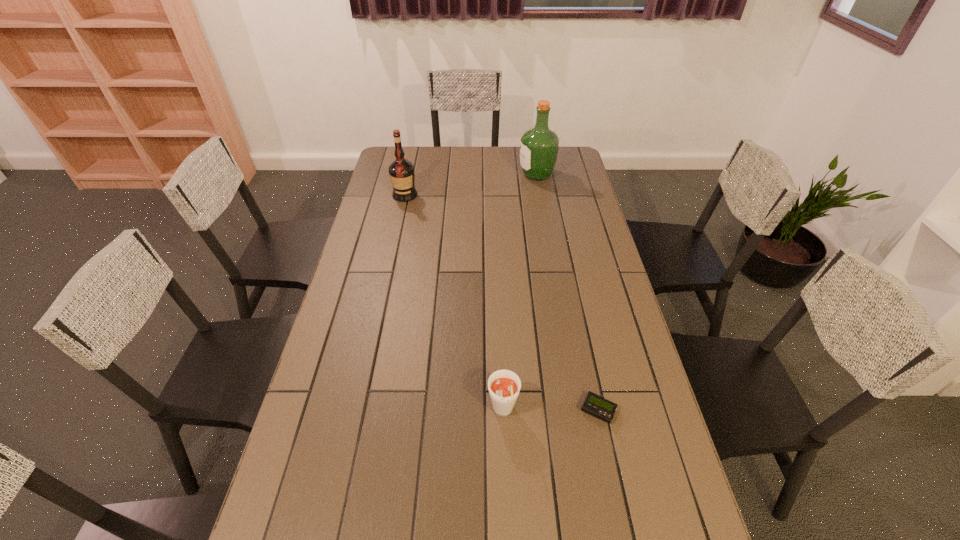
This screenshot has width=960, height=540. I want to click on empty space that is in between the shortest object and the third object from right to left, so click(x=550, y=411).

Image resolution: width=960 pixels, height=540 pixels. I want to click on vacant region between the right liquor and the root beer, so click(x=519, y=294).

Image resolution: width=960 pixels, height=540 pixels. Find the location of `object that stands as the closest to the root beer`. object that stands as the closest to the root beer is located at coordinates click(595, 405).

Identify the location of the second closest object to the third tallest object. The height and width of the screenshot is (540, 960). (401, 171).

The height and width of the screenshot is (540, 960). Find the location of `vacant space that satisfies the following two spatial constraints: 1. on the front-facing side of the farther liquor; 2. on the right side of the shortest object`. vacant space that satisfies the following two spatial constraints: 1. on the front-facing side of the farther liquor; 2. on the right side of the shortest object is located at coordinates (578, 410).

You are a GUI agent. You are given a task and a screenshot of the screen. Output one action in this format:
    pyautogui.click(x=<x>, y=<y>)
    Task: Click on the free space in the image that satisfies the following two spatial constraints: 1. on the front-facing side of the right liquor; 2. on the right side of the beeper
    The width and height of the screenshot is (960, 540).
    Given the screenshot: What is the action you would take?
    pyautogui.click(x=578, y=410)

This screenshot has height=540, width=960. Identify the location of free region that satisfies the following two spatial constraints: 1. on the front-facing side of the farther liquor; 2. on the right side of the beeper. (578, 410).

Identify the location of vacant region that satisfies the following two spatial constraints: 1. on the front-facing side of the farther liquor; 2. on the surface of the third shortest object. (540, 195).

Where is `free spot that satisfies the following two spatial constraints: 1. on the front-facing side of the right liquor; 2. on the drink side of the root beer`? The height and width of the screenshot is (540, 960). free spot that satisfies the following two spatial constraints: 1. on the front-facing side of the right liquor; 2. on the drink side of the root beer is located at coordinates (578, 413).

Locate an element on the screen. This screenshot has height=540, width=960. vacant region that satisfies the following two spatial constraints: 1. on the front-facing side of the farthest object; 2. on the surface of the second farthest object is located at coordinates (540, 195).